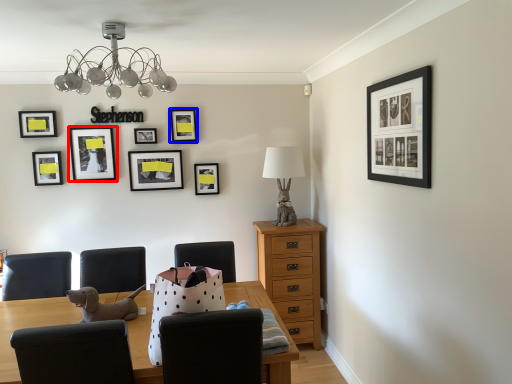
Question: Among these objects, which one is farthest to the camera, picture frame (highlighted by a red box) or picture frame (highlighted by a blue box)?

Choices:
 (A) picture frame
 (B) picture frame

Answer: (B)